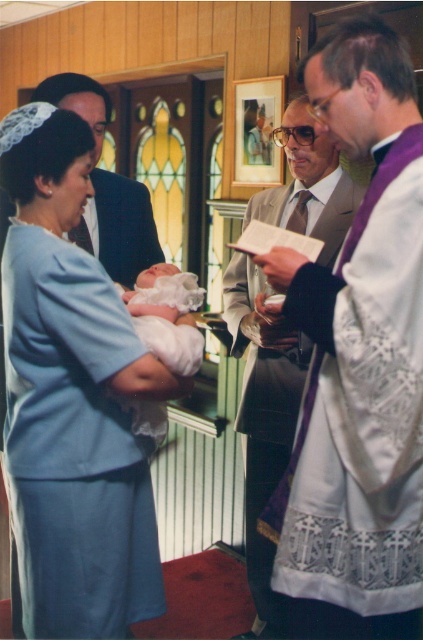
Between matte black suit at upper left and white satin newborn at center, which one is positioned higher?

matte black suit at upper left is higher up.

Where is `matte black suit at upper left`? This screenshot has width=423, height=640. matte black suit at upper left is located at coordinates (121, 227).

Is point (13, 292) farther from viewer compared to point (252, 460)?

No, (13, 292) is closer to viewer.

Who is more forward, (57, 634) or (285, 198)?

Point (57, 634) is in front.

The width and height of the screenshot is (423, 640). I want to click on matte blue dress at center, so click(71, 397).

Where is `matte blue dress at center`? matte blue dress at center is located at coordinates [x=71, y=397].

Between matte blue dress at center and white satin newborn at center, which one is positioned higher?

white satin newborn at center is above.

In the scene shown: Does matte blue dress at center have a greater width compared to white satin newborn at center?

Yes.

This screenshot has width=423, height=640. In order to click on matte blue dress at center in this screenshot , I will do `click(71, 397)`.